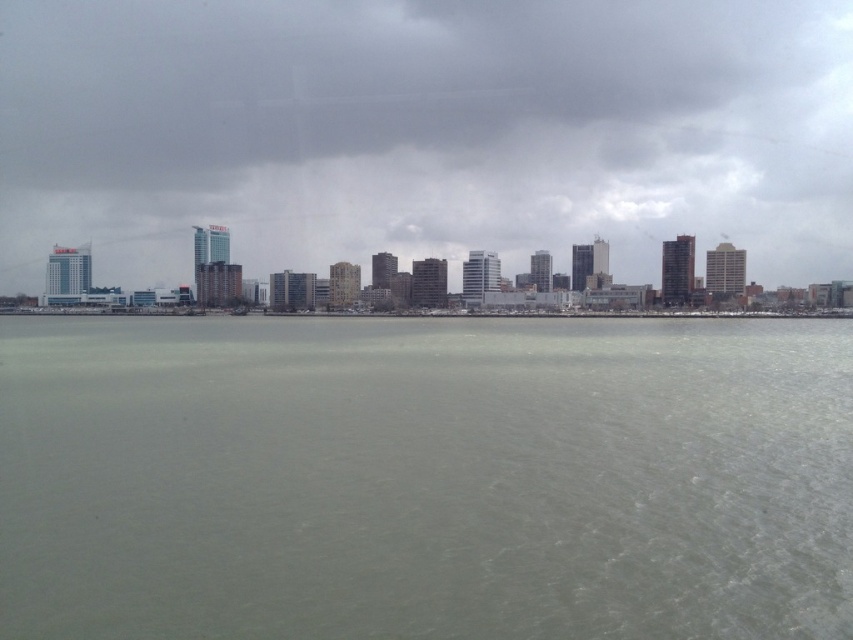
Question: Is gray matte water at center to the left of gray cloudy sky at upper center from the viewer's perspective?

Choices:
 (A) no
 (B) yes

Answer: (A)

Question: Which of the following is the farthest from the observer?

Choices:
 (A) (67, 371)
 (B) (273, 12)

Answer: (B)

Question: Which of the following is the farthest from the observer?

Choices:
 (A) gray matte water at center
 (B) gray cloudy sky at upper center

Answer: (B)

Question: Which of the following is the farthest from the observer?

Choices:
 (A) gray cloudy sky at upper center
 (B) gray matte water at center

Answer: (A)

Question: Does gray matte water at center have a greater width compared to gray cloudy sky at upper center?

Choices:
 (A) no
 (B) yes

Answer: (A)

Question: Is gray matte water at center to the right of gray cloudy sky at upper center from the viewer's perspective?

Choices:
 (A) yes
 (B) no

Answer: (A)